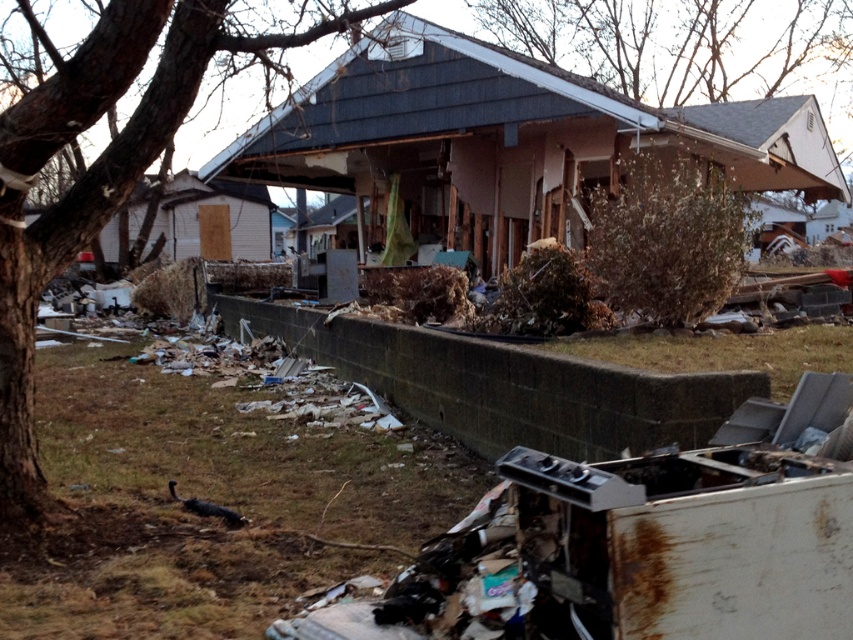
Between brown rough bark tree at left and bare branches at upper center, which one has less height?

Standing shorter between the two is bare branches at upper center.

Does brown rough bark tree at left have a larger size compared to bare branches at upper center?

Correct, brown rough bark tree at left is larger in size than bare branches at upper center.

Find the location of a particular element. Image resolution: width=853 pixels, height=640 pixels. brown rough bark tree at left is located at coordinates (96, 172).